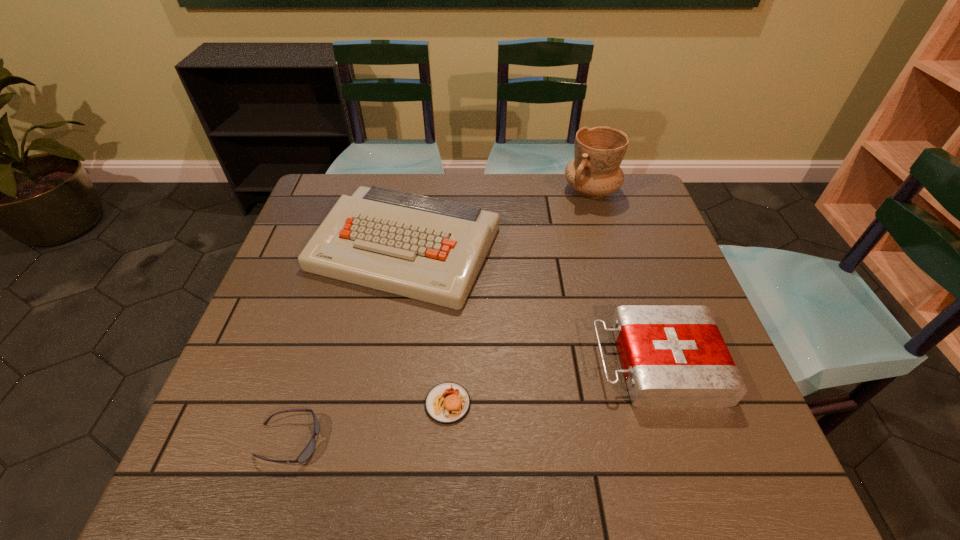
Find the location of `pottery`. pottery is located at coordinates (595, 171).

This screenshot has width=960, height=540. Find the location of `computer keyboard`. computer keyboard is located at coordinates (429, 249).

Find the location of a particular element. This screenshot has width=960, height=540. the first-aid kit is located at coordinates (673, 356).

Find the location of a particular element. patty is located at coordinates (446, 403).

Image resolution: width=960 pixels, height=540 pixels. I want to click on the shortest object, so click(308, 451).

At what (x,y) coordinates should I click in order to perform the action: click on free space located on the right of the tallest object. Please return your answer as a coordinate pair (x, y). This screenshot has height=540, width=960. Looking at the image, I should click on (641, 191).

Find the location of a particular element. This screenshot has width=960, height=540. vacant space located on the front of the computer keyboard is located at coordinates (392, 327).

Find the location of a particular element. free space located on the front side of the first-aid kit is located at coordinates (554, 363).

This screenshot has width=960, height=540. Find the location of `free space located on the front side of the first-aid kit`. free space located on the front side of the first-aid kit is located at coordinates (494, 363).

You are a GUI agent. You are given a task and a screenshot of the screen. Output one action in this format:
    pyautogui.click(x=<x>, y=<y>)
    Task: Click on the vacant space located 0.350m on the front side of the first-aid kit
    
    Given the screenshot: What is the action you would take?
    pyautogui.click(x=434, y=363)